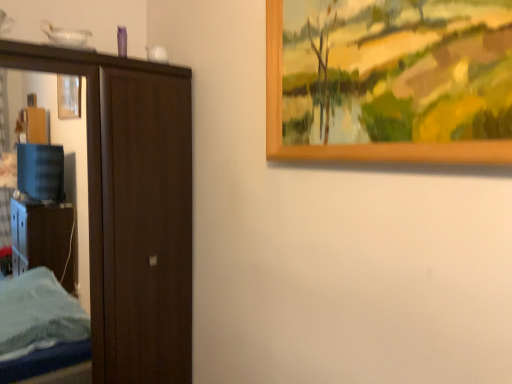
What is the approximate height of wooden picture frame at upper right?

wooden picture frame at upper right is 26.33 inches in height.

What are the coordinates of `wooden picture frame at upper right` in the screenshot? It's located at (358, 144).

Image resolution: width=512 pixels, height=384 pixels. What do you see at coordinates (358, 144) in the screenshot?
I see `wooden picture frame at upper right` at bounding box center [358, 144].

Identify the location of dark wood door at left. The width and height of the screenshot is (512, 384). (133, 209).

What is the approximate width of dark wood door at left?

20.64 centimeters.

The width and height of the screenshot is (512, 384). Describe the element at coordinates (133, 209) in the screenshot. I see `dark wood door at left` at that location.

Find the location of a particular element. wooden picture frame at upper right is located at coordinates (358, 144).

Is wooden picture frame at upper right to the right of dark wood door at left from the viewer's perspective?

Correct, you'll find wooden picture frame at upper right to the right of dark wood door at left.

Is wooden picture frame at upper right closer to the viewer compared to dark wood door at left?

Yes, it is in front of dark wood door at left.

Between point (425, 150) and point (152, 378), which one is positioned behind?

The point (152, 378) is more distant.

From the image's perspective, would you say wooden picture frame at upper right is shown under dark wood door at left?

No, from the image's perspective, wooden picture frame at upper right is not below dark wood door at left.

From a real-world perspective, which object rests below the other?

dark wood door at left is physically lower.

Which of these two, wooden picture frame at upper right or dark wood door at left, is wider?

dark wood door at left is wider.

Which of these two, wooden picture frame at upper right or dark wood door at left, stands shorter?

wooden picture frame at upper right.

Considering the sizes of objects wooden picture frame at upper right and dark wood door at left in the image provided, who is smaller, wooden picture frame at upper right or dark wood door at left?

With smaller size is wooden picture frame at upper right.

Looking at this image, would you say dark wood door at left is part of wooden picture frame at upper right's contents?

No, dark wood door at left is not a part of wooden picture frame at upper right.

Are wooden picture frame at upper right and dark wood door at left making contact?

No, wooden picture frame at upper right is not beside dark wood door at left.

Is wooden picture frame at upper right looking in the opposite direction of dark wood door at left?

wooden picture frame at upper right does not have its back to dark wood door at left.

What's the angular difference between wooden picture frame at upper right and dark wood door at left's facing directions?

87.6 degrees separate the facing orientations of wooden picture frame at upper right and dark wood door at left.

What are the coordinates of `door behind the wooden picture frame at upper right` in the screenshot? It's located at (133, 209).

Between dark wood door at left and wooden picture frame at upper right, which one appears on the right side from the viewer's perspective?

wooden picture frame at upper right.

Is dark wood door at left closer to camera compared to wooden picture frame at upper right?

No, dark wood door at left is behind wooden picture frame at upper right.

Is point (188, 173) farther from camera compared to point (470, 145)?

Yes, it is behind point (470, 145).

From the image's perspective, does dark wood door at left appear lower than wooden picture frame at upper right?

Indeed, from the image's perspective, dark wood door at left is shown beneath wooden picture frame at upper right.

From a real-world perspective, which object rests below the other?

dark wood door at left.

Does dark wood door at left have a greater width compared to wooden picture frame at upper right?

Indeed, dark wood door at left has a greater width compared to wooden picture frame at upper right.

Is dark wood door at left taller than wooden picture frame at upper right?

Yes.

From the picture: Who is bigger, dark wood door at left or wooden picture frame at upper right?

dark wood door at left is bigger.

Would you say dark wood door at left contains wooden picture frame at upper right?

That's incorrect, wooden picture frame at upper right is not inside dark wood door at left.

Are dark wood door at left and wooden picture frame at upper right located far from each other?

dark wood door at left is actually quite close to wooden picture frame at upper right.

Is dark wood door at left facing towards wooden picture frame at upper right?

Yes, dark wood door at left faces towards wooden picture frame at upper right.

How many degrees apart are the facing directions of dark wood door at left and wooden picture frame at upper right?

The facing directions of dark wood door at left and wooden picture frame at upper right are 87.6 degrees apart.

How far apart are dark wood door at left and wooden picture frame at upper right?

dark wood door at left and wooden picture frame at upper right are 36.60 inches apart from each other.

Locate an element on the screen. picture frame above the dark wood door at left (from a real-world perspective) is located at coordinates (358, 144).

At what (x,y) coordinates should I click in order to perform the action: click on door behind the wooden picture frame at upper right. Please return your answer as a coordinate pair (x, y). Looking at the image, I should click on (133, 209).

Identify the location of picture frame that appears in front of the dark wood door at left. (358, 144).